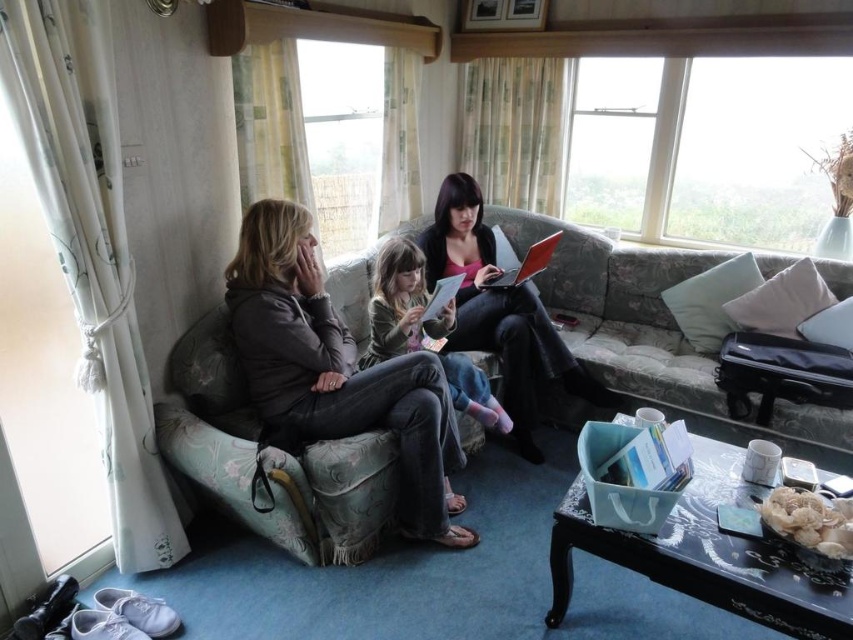
You are organizing a study session in the living room and need to place both the metallic silver laptop at center and the white paper book at center on the sofa. According to the scene, which object should be placed to the left to ensure they are positioned correctly?

The white paper book at center should be placed to the left because the metallic silver laptop at center is to the right of it.

You are a delivery person trying to place a small package between the matte gray sweater at left and the white paper book at lower center. Can you fit the package there if it measures 80 centimeters in length?

The distance between the matte gray sweater at left and the white paper book at lower center is 87.01 centimeters. Since the package is 80 centimeters long, it should fit comfortably within the space.